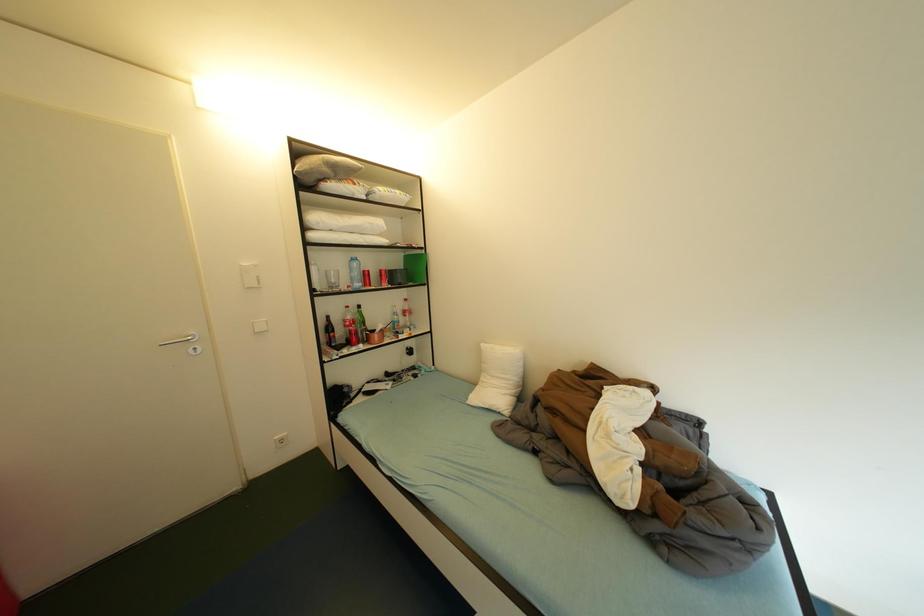
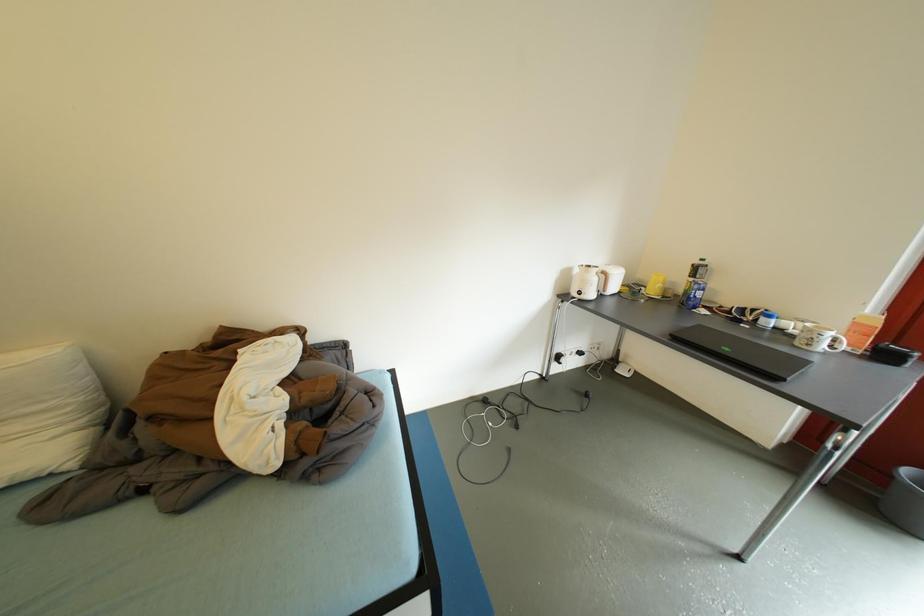
Consider the image. The images are taken continuously from a first-person perspective. In which direction is your viewpoint rotating?

The camera's rotation is toward right-down.